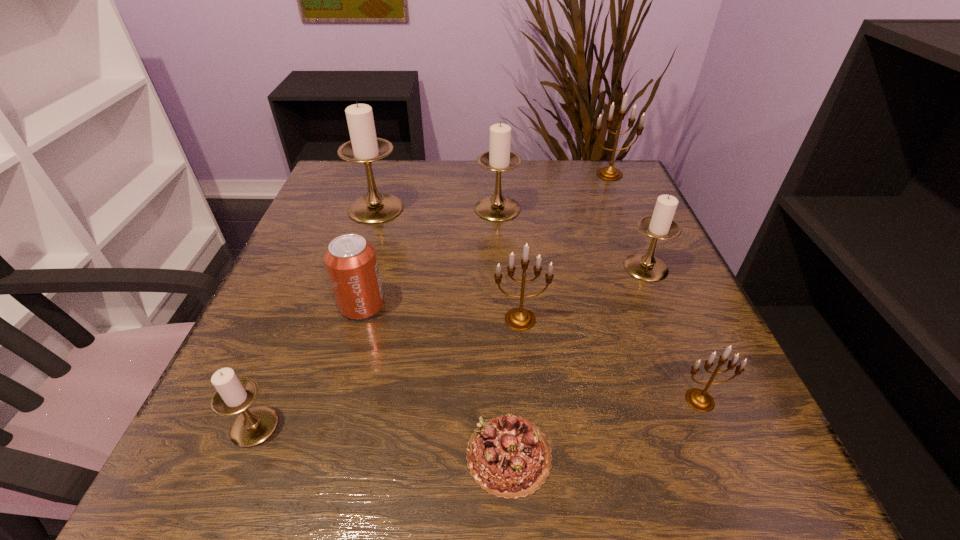
This screenshot has height=540, width=960. Find the location of `white candle holder that is the nearest to the third white candle holder from left to right`. white candle holder that is the nearest to the third white candle holder from left to right is located at coordinates (364, 147).

You are a GUI agent. You are given a task and a screenshot of the screen. Output one action in this format:
    pyautogui.click(x=<x>, y=<y>)
    Task: Click on the white candle holder that can be found as the closest to the biggest white candle holder
    This screenshot has width=960, height=540.
    Given the screenshot: What is the action you would take?
    pyautogui.click(x=499, y=158)

Locate which gold candelabrum is the second closest to the chocolate cake. Please provide its 2D coordinates. Your answer should be formatted as a tuple, i.e. [(x, y)], where the tuple contains the x and y coordinates of a point satisfying the conditions above.

[(699, 399)]

Identify which gold candelabrum is located as the third nearest to the second white candle holder from right to left. Please provide its 2D coordinates. Your answer should be formatted as a tuple, i.e. [(x, y)], where the tuple contains the x and y coordinates of a point satisfying the conditions above.

[(699, 399)]

You are a GUI agent. You are given a task and a screenshot of the screen. Output one action in this format:
    pyautogui.click(x=<x>, y=<y>)
    Task: Click on the vacant space that satisfies the following two spatial constraints: 1. on the back side of the smallest white candle holder; 2. on the left side of the second biggest white candle holder
    The image size is (960, 540).
    Given the screenshot: What is the action you would take?
    pyautogui.click(x=344, y=208)

Find the location of a particular element. This screenshot has width=960, height=540. vacant space that satisfies the following two spatial constraints: 1. on the back side of the tallest candle holder; 2. on the right side of the farthest gold candelabrum is located at coordinates (387, 174).

This screenshot has width=960, height=540. Find the location of `blank space that satisfies the following two spatial constraints: 1. on the back side of the farthest gold candelabrum; 2. on the right side of the smallest gold candelabrum`. blank space that satisfies the following two spatial constraints: 1. on the back side of the farthest gold candelabrum; 2. on the right side of the smallest gold candelabrum is located at coordinates click(x=605, y=174).

The height and width of the screenshot is (540, 960). Find the location of `vacant space that satisfies the following two spatial constraints: 1. on the back side of the farthest gold candelabrum; 2. on the left side of the smallest white candle holder`. vacant space that satisfies the following two spatial constraints: 1. on the back side of the farthest gold candelabrum; 2. on the left side of the smallest white candle holder is located at coordinates (358, 174).